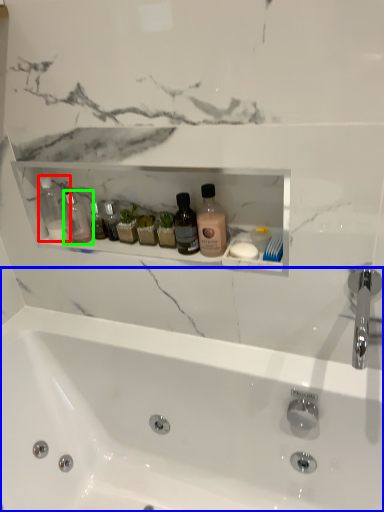
Question: Which object is the farthest from toiletry (highlighted by a red box)? Choose among these: bathtub (highlighted by a blue box) or toiletry (highlighted by a green box).

Choices:
 (A) bathtub
 (B) toiletry

Answer: (A)